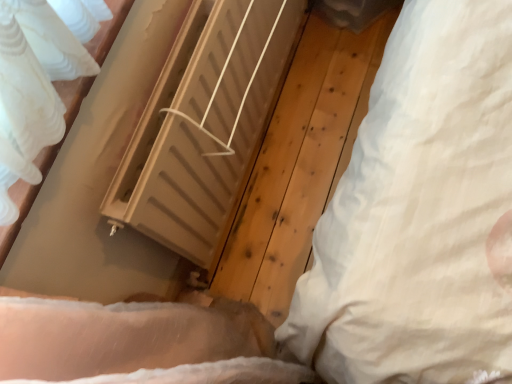
Measure the distance between point (362,164) and camera.

Point (362,164) is 35.94 inches from camera.

Where is `white soft pillow at right`? white soft pillow at right is located at coordinates (420, 213).

Image resolution: width=512 pixels, height=384 pixels. Describe the element at coordinates (420, 213) in the screenshot. I see `white soft pillow at right` at that location.

In order to face white soft pillow at right, should I rotate leftwards or rightwards?

A 22.929 degree turn to the right will do.

Based on the photo, what is the approximate height of white soft pillow at right?

The height of white soft pillow at right is 4.29 feet.

Locate an element on the screen. This screenshot has width=512, height=384. matte beige radiator at center is located at coordinates (203, 124).

Describe the element at coordinates (203, 124) in the screenshot. The width and height of the screenshot is (512, 384). I see `matte beige radiator at center` at that location.

Where is `white soft pillow at right`? Image resolution: width=512 pixels, height=384 pixels. white soft pillow at right is located at coordinates (420, 213).

Is white soft pillow at right to the right of matte beige radiator at center from the viewer's perspective?

Yes, white soft pillow at right is to the right of matte beige radiator at center.

Is the depth of white soft pillow at right greater than that of matte beige radiator at center?

That is False.

Does point (405, 255) come farther from viewer compared to point (179, 153)?

No, it is not.

From the image's perspective, is white soft pillow at right under matte beige radiator at center?

Correct, white soft pillow at right appears lower than matte beige radiator at center in the image.

From a real-world perspective, is white soft pillow at right positioned under matte beige radiator at center based on gravity?

No, from a real-world perspective, white soft pillow at right is not beneath matte beige radiator at center.

Consider the image. Which object is thinner, white soft pillow at right or matte beige radiator at center?

white soft pillow at right is thinner.

Does white soft pillow at right have a greater height compared to matte beige radiator at center?

Correct, white soft pillow at right is much taller as matte beige radiator at center.

Does white soft pillow at right have a larger size compared to matte beige radiator at center?

Actually, white soft pillow at right might be smaller than matte beige radiator at center.

Is white soft pillow at right outside of matte beige radiator at center?

Yes.

Are white soft pillow at right and matte beige radiator at center making contact?

They are not placed beside each other.

Is white soft pillow at right oriented towards matte beige radiator at center?

Yes, white soft pillow at right is facing matte beige radiator at center.

How different are the orientations of white soft pillow at right and matte beige radiator at center in degrees?

The angle between the facing direction of white soft pillow at right and the facing direction of matte beige radiator at center is 1.01 degrees.

The width and height of the screenshot is (512, 384). Find the location of `pillow in front of the matte beige radiator at center`. pillow in front of the matte beige radiator at center is located at coordinates (420, 213).

Visually, is matte beige radiator at center positioned to the left or to the right of white soft pillow at right?

In the image, matte beige radiator at center appears on the left side of white soft pillow at right.

Consider the image. Considering the positions of objects matte beige radiator at center and white soft pillow at right in the image provided, who is behind, matte beige radiator at center or white soft pillow at right?

Positioned behind is matte beige radiator at center.

Is point (188, 132) closer to camera compared to point (500, 122)?

No, (188, 132) is further to viewer.

From the image's perspective, is matte beige radiator at center over white soft pillow at right?

Yes, from the image's perspective, matte beige radiator at center is above white soft pillow at right.

From a real-world perspective, who is located lower, matte beige radiator at center or white soft pillow at right?

matte beige radiator at center.

Which object is thinner, matte beige radiator at center or white soft pillow at right?

Thinner between the two is white soft pillow at right.

Considering the relative sizes of matte beige radiator at center and white soft pillow at right in the image provided, is matte beige radiator at center shorter than white soft pillow at right?

Yes.

Is matte beige radiator at center smaller than white soft pillow at right?

No, matte beige radiator at center is not smaller than white soft pillow at right.

Is white soft pillow at right inside matte beige radiator at center?

No, white soft pillow at right is not surrounded by matte beige radiator at center.

Is matte beige radiator at center not near white soft pillow at right?

matte beige radiator at center is actually quite close to white soft pillow at right.

Does matte beige radiator at center turn towards white soft pillow at right?

Yes.

In the scene shown: What's the angular difference between matte beige radiator at center and white soft pillow at right's facing directions?

There is a 1.01-degree angle between the facing directions of matte beige radiator at center and white soft pillow at right.

Find the location of a particular element. radiator behind the white soft pillow at right is located at coordinates (203, 124).

Where is `pillow below the matte beige radiator at center (from the image's perspective)`? The height and width of the screenshot is (384, 512). pillow below the matte beige radiator at center (from the image's perspective) is located at coordinates (420, 213).

Identify the location of radiator located behind the white soft pillow at right. The width and height of the screenshot is (512, 384). (203, 124).